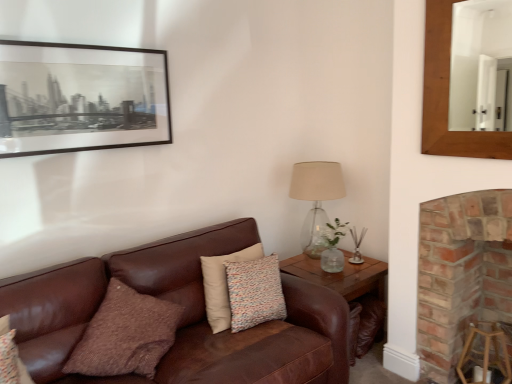
Question: From the image's perspective, does translucent glass table lamp at right appear lower than black matte picture frame at upper left?

Choices:
 (A) no
 (B) yes

Answer: (B)

Question: Is the depth of translucent glass table lamp at right greater than that of black matte picture frame at upper left?

Choices:
 (A) yes
 (B) no

Answer: (A)

Question: Is there a large distance between translucent glass table lamp at right and black matte picture frame at upper left?

Choices:
 (A) no
 (B) yes

Answer: (B)

Question: From a real-world perspective, is translucent glass table lamp at right on top of black matte picture frame at upper left?

Choices:
 (A) no
 (B) yes

Answer: (A)

Question: Is translucent glass table lamp at right located outside black matte picture frame at upper left?

Choices:
 (A) no
 (B) yes

Answer: (B)

Question: Can you confirm if translucent glass table lamp at right is taller than black matte picture frame at upper left?

Choices:
 (A) no
 (B) yes

Answer: (B)

Question: From the image's perspective, does wooden mirror at upper right appear higher than wooden stool at lower right?

Choices:
 (A) no
 (B) yes

Answer: (B)

Question: From a real-world perspective, is wooden mirror at upper right on top of wooden stool at lower right?

Choices:
 (A) no
 (B) yes

Answer: (B)

Question: Is wooden mirror at upper right to the right of wooden stool at lower right from the viewer's perspective?

Choices:
 (A) yes
 (B) no

Answer: (B)

Question: Considering the relative sizes of wooden mirror at upper right and wooden stool at lower right in the image provided, is wooden mirror at upper right thinner than wooden stool at lower right?

Choices:
 (A) yes
 (B) no

Answer: (A)

Question: Does wooden mirror at upper right have a smaller size compared to wooden stool at lower right?

Choices:
 (A) no
 (B) yes

Answer: (B)

Question: Does wooden mirror at upper right have a greater width compared to wooden stool at lower right?

Choices:
 (A) yes
 (B) no

Answer: (B)

Question: Considering the relative sizes of translucent glass table lamp at right and wooden mirror at upper right in the image provided, is translucent glass table lamp at right wider than wooden mirror at upper right?

Choices:
 (A) no
 (B) yes

Answer: (B)